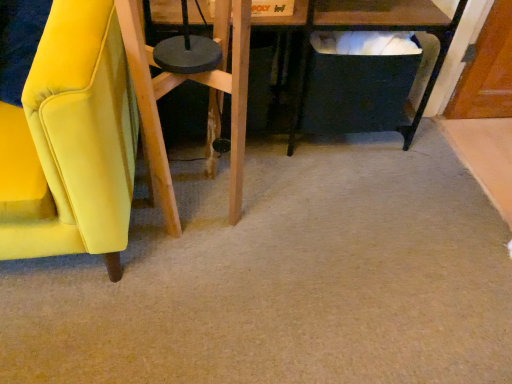
Question: Should I look upward or downward to see wooden bar stool at center?

Choices:
 (A) up
 (B) down

Answer: (A)